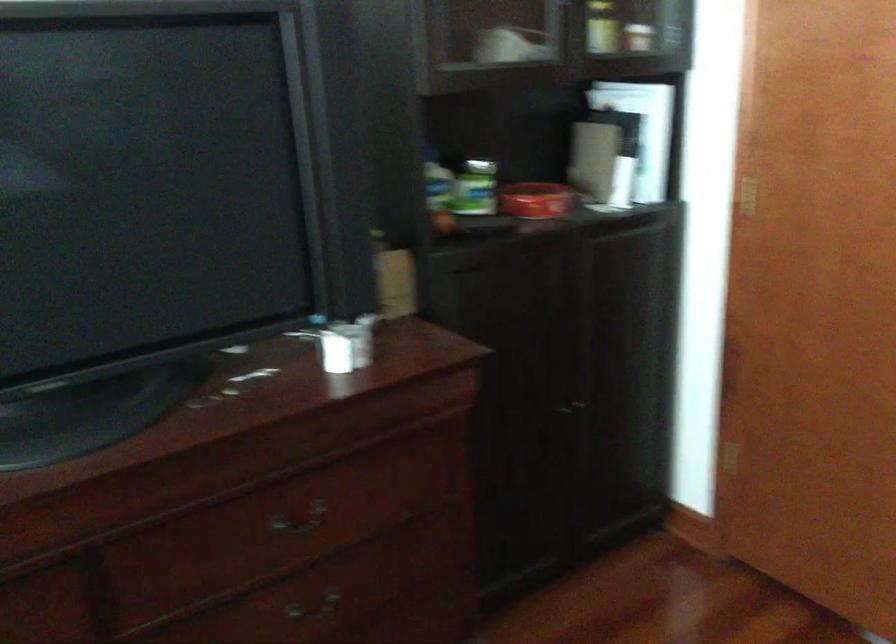
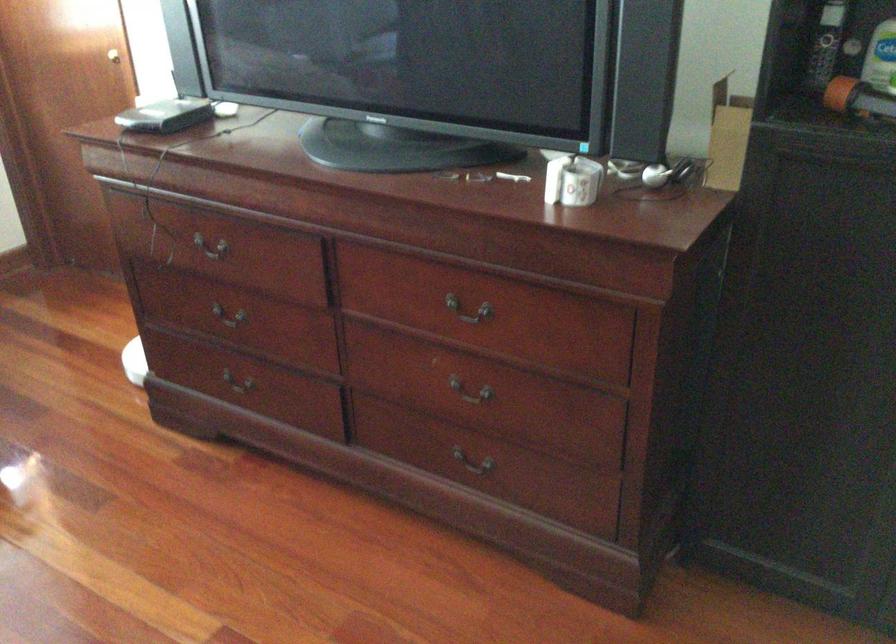
Where in the second image is the point corresponding to point (277, 522) from the first image?

(469, 310)